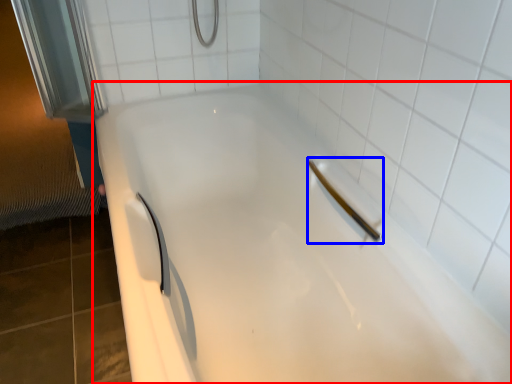
Question: Which object appears farthest to the camera in this image, bathtub (highlighted by a red box) or shower (highlighted by a blue box)?

Choices:
 (A) bathtub
 (B) shower

Answer: (B)